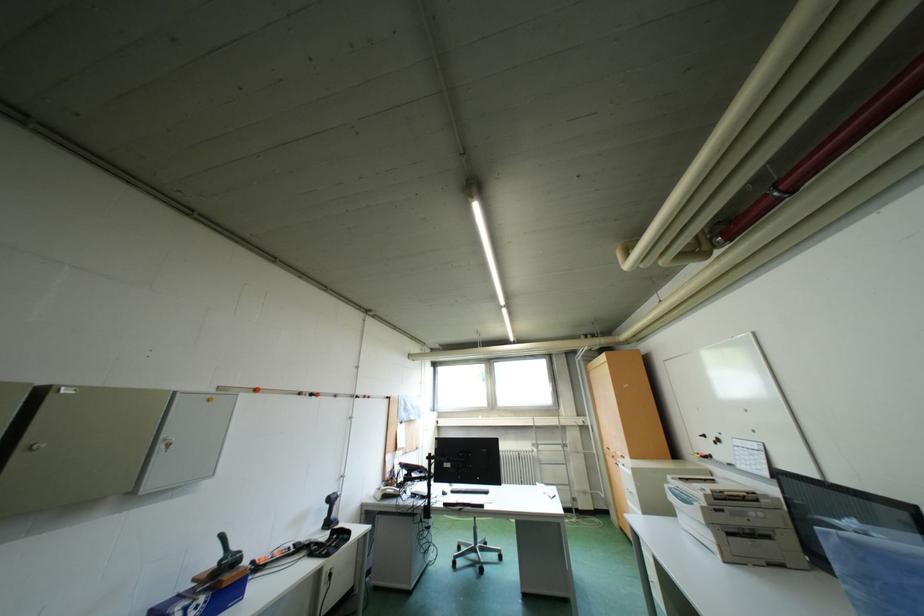
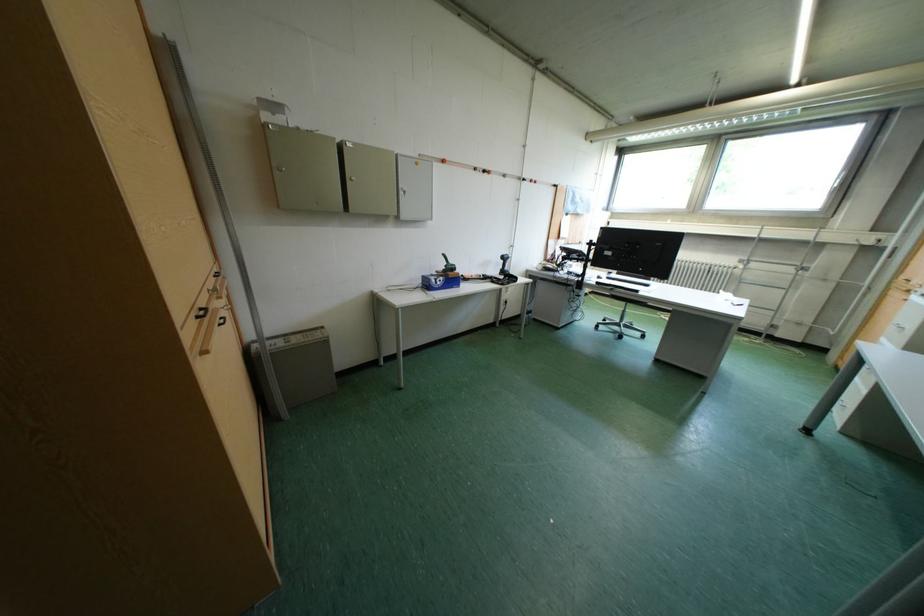
First-person continuous shooting, in which direction is the camera rotating?

The camera rotated toward left-down.